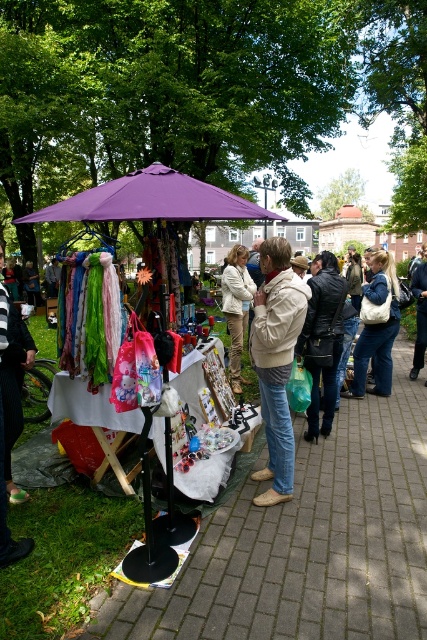
Which is above, purple fabric umbrella at center or leather jacket at center?

purple fabric umbrella at center is higher up.

Find the location of a particular element. Image resolution: width=427 pixels, height=640 pixels. purple fabric umbrella at center is located at coordinates [152, 200].

From the picture: Is matte plastic bag at center to the right of purple fabric umbrella at center from the viewer's perspective?

Yes, matte plastic bag at center is to the right of purple fabric umbrella at center.

Does matte plastic bag at center appear under purple fabric umbrella at center?

Yes.

The image size is (427, 640). What are the coordinates of `matte plastic bag at center` in the screenshot? It's located at (307, 541).

Consider the image. Is matte plastic bag at center to the left of white leather bag at right from the viewer's perspective?

Yes, matte plastic bag at center is to the left of white leather bag at right.

Does point (146, 602) come farther from viewer compared to point (359, 362)?

No, (146, 602) is closer to viewer.

I want to click on matte plastic bag at center, so click(307, 541).